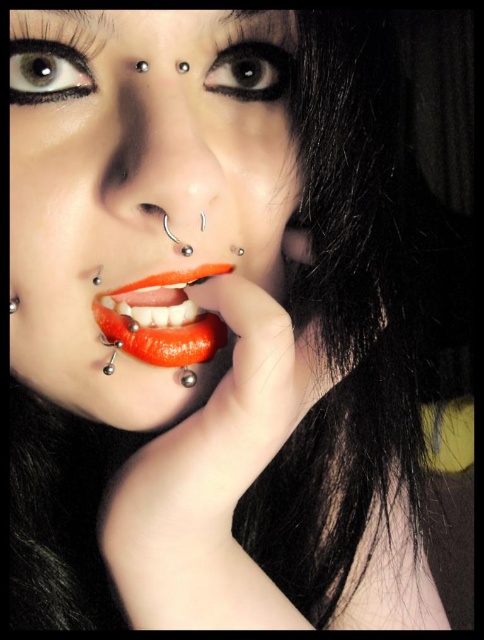
Question: Can you confirm if black matte eye at upper center is positioned above black matte eyebrow at upper center?

Choices:
 (A) yes
 (B) no

Answer: (B)

Question: Can you confirm if silver metallic nose ring at center is positioned below shiny red lips at center?

Choices:
 (A) yes
 (B) no

Answer: (B)

Question: Which object is farther from the camera taking this photo?

Choices:
 (A) brown matte eye at upper left
 (B) silver metallic nose ring at center
 (C) shiny orange lips at center
 (D) black matte eye at upper center

Answer: (D)

Question: Which point is closer to the camera?

Choices:
 (A) (28, 74)
 (B) (183, 336)

Answer: (A)

Question: Is shiny orange lips at center wider than black matte eyebrow at upper left?

Choices:
 (A) no
 (B) yes

Answer: (B)

Question: Which point appears farthest from the camera in this image?

Choices:
 (A) (104, 340)
 (B) (215, 90)
 (C) (227, 202)

Answer: (A)